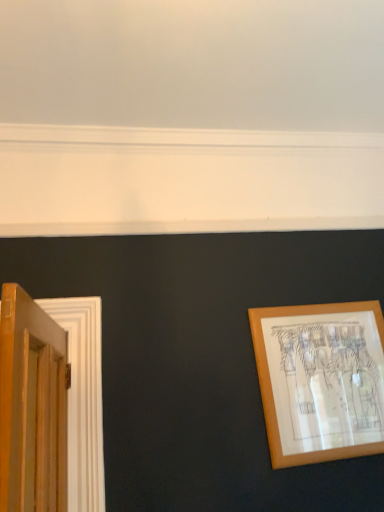
The image size is (384, 512). Describe the element at coordinates (321, 380) in the screenshot. I see `wooden frame at right` at that location.

Identify the location of wooden frame at right. coord(321,380).

Identify the location of wooden frame at right. The image size is (384, 512). (321, 380).